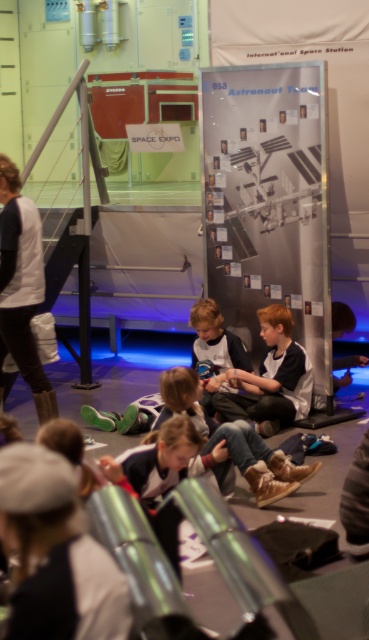
You are a photographer at the event and need to capture a clear photo of both the matte black jacket at center and the light brown hair at center in the same frame. The camera you have can only focus on objects within a 15 inch range. Will you be able to capture both subjects clearly in one shot?

The distance between the matte black jacket at center and the light brown hair at center is 18.09 inches, which exceeds the camera focus range of 15 inches. Therefore, you cannot capture both subjects clearly in one shot.

You are a photographer at the event and want to capture a photo of the matte black jacket at center and the light brown hair at center. From the perspective of the children sitting on the floor, which object is on the right side?

The matte black jacket at center is positioned on the right side of light brown hair at center, so from the children sitting on the floor, the matte black jacket at center is on the right side.

Consider the image. You are standing at the entrance of the science exhibition and see the matte black jacket at center near the ESA Astronaut banner. If you want to reach the jacket quickly, can you walk straight ahead without obstacles?

The distance between the matte black jacket at center and the viewer is 6.38 meters. Since there are no obstacles mentioned in the scene description, you can walk straight ahead to reach the jacket quickly.